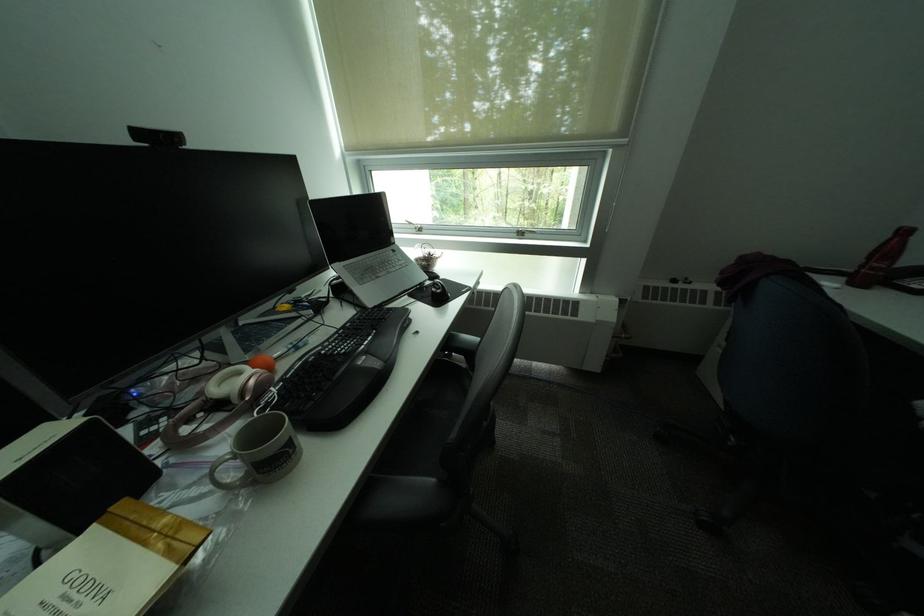
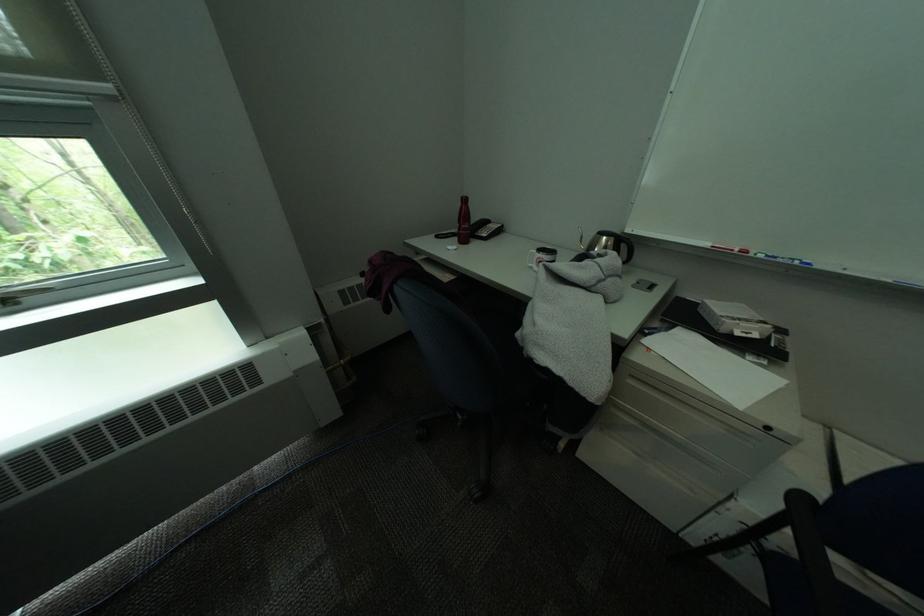
Find the pixel in the second image that matches point (886, 265) in the first image.

(475, 228)